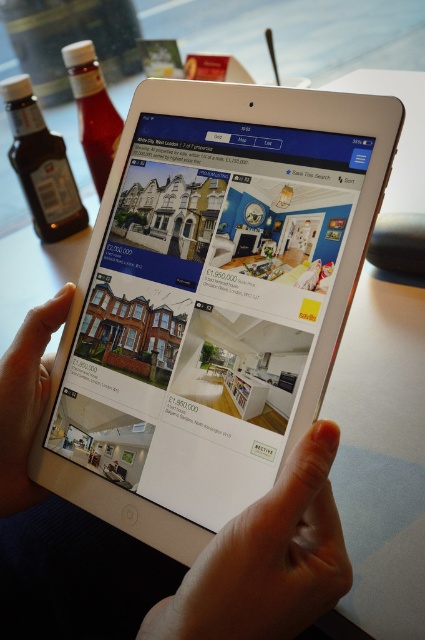
Who is lower down, white glossy tablet computer at center or skinny white hand at lower center?

skinny white hand at lower center is below.

The width and height of the screenshot is (425, 640). What do you see at coordinates (210, 300) in the screenshot? I see `white glossy tablet computer at center` at bounding box center [210, 300].

Which is behind, point (59, 490) or point (25, 380)?

The point (25, 380) is behind.

Find the location of a particular element. The height and width of the screenshot is (640, 425). white glossy tablet computer at center is located at coordinates (210, 300).

What do you see at coordinates (210, 300) in the screenshot?
I see `white glossy tablet computer at center` at bounding box center [210, 300].

Who is lower down, white glossy tablet computer at center or smooth white tablet at center?

smooth white tablet at center is below.

Is point (76, 320) positioned before point (266, 548)?

No, (76, 320) is behind (266, 548).

Where is `white glossy tablet computer at center`? Image resolution: width=425 pixels, height=640 pixels. white glossy tablet computer at center is located at coordinates (210, 300).

Does skinny white finger at upper center have a greater width compared to skinny white hand at lower center?

Indeed, skinny white finger at upper center has a greater width compared to skinny white hand at lower center.

Can you confirm if skinny white finger at upper center is positioned to the right of skinny white hand at lower center?

Indeed, skinny white finger at upper center is positioned on the right side of skinny white hand at lower center.

Between point (255, 541) and point (61, 316), which one is positioned behind?

The point (61, 316) is behind.

Find the location of a particular element. The width and height of the screenshot is (425, 640). skinny white finger at upper center is located at coordinates (266, 560).